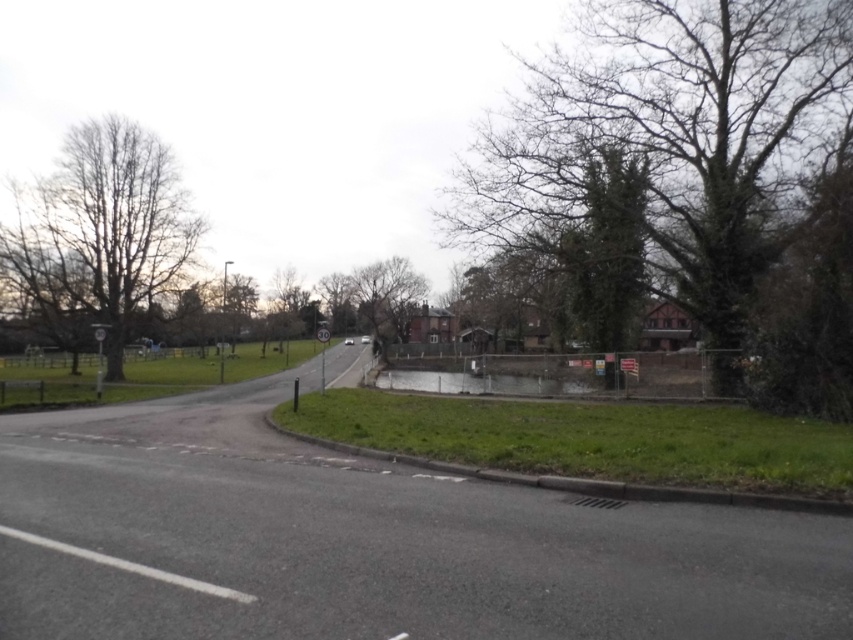
You are standing at the center of the road and looking towards the upper right corner of the image. What do you see at the point marked by the coordinates point (670, 141)?

At the point marked by the coordinates point (670, 141), you see bare branches at upper right.

You are standing at the center of the road in the image. If you look towards the upper right corner of the image, where would you find the bare branches at upper right?

The bare branches at upper right are located at the 2D coordinates point (x=670, y=141) in the image.

You are a painter standing on the road and want to paint both the bare branches at upper right and the bare wood tree at left. Which one should you move closer to in order to capture their full size in your painting?

You should move closer to the bare wood tree at left because the bare branches at upper right are larger in size, so moving closer to the smaller tree allows you to fit its entire form within the painting frame.